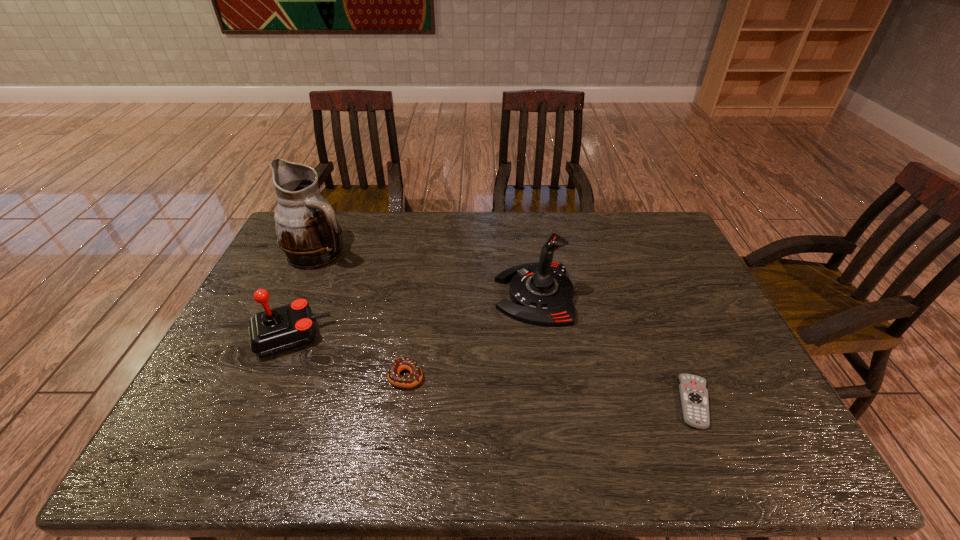
What are the coordinates of `vacant space that's between the pitcher and the third object from right to left` in the screenshot? It's located at (363, 315).

This screenshot has height=540, width=960. I want to click on free spot between the rightmost object and the pitcher, so click(507, 327).

Find the location of `vacant space that is in between the taller joystick and the shortest object`. vacant space that is in between the taller joystick and the shortest object is located at coordinates (614, 348).

The width and height of the screenshot is (960, 540). What are the coordinates of `vacant area between the rightmost object and the fourth tallest object` in the screenshot? It's located at (550, 389).

The image size is (960, 540). I want to click on vacant space that's between the second shortest object and the left joystick, so pyautogui.click(x=348, y=356).

The height and width of the screenshot is (540, 960). Find the location of `free spot between the pitcher and the rightmost object`. free spot between the pitcher and the rightmost object is located at coordinates (507, 327).

This screenshot has width=960, height=540. What are the coordinates of `free space between the tallest object and the right joystick` in the screenshot? It's located at (427, 274).

Where is `the fourth closest object relative to the doughnut`? This screenshot has width=960, height=540. the fourth closest object relative to the doughnut is located at coordinates (694, 395).

Where is `the fourth closest object to the remote control`? The width and height of the screenshot is (960, 540). the fourth closest object to the remote control is located at coordinates (308, 233).

Locate an element on the screen. blank space that satisfies the following two spatial constraints: 1. on the back side of the remote control; 2. from the spout of the pitcher is located at coordinates (632, 253).